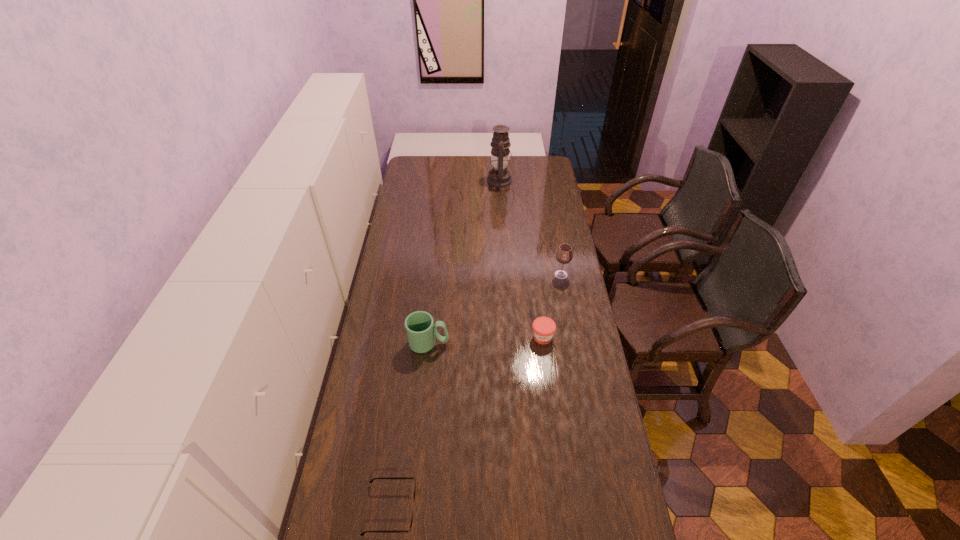
Where is `the tallest object`? The height and width of the screenshot is (540, 960). the tallest object is located at coordinates (499, 176).

The width and height of the screenshot is (960, 540). Find the location of `oil lamp`. oil lamp is located at coordinates (499, 176).

Identify the location of the rightmost object. (564, 255).

This screenshot has height=540, width=960. Identify the location of the fourth shortest object. (564, 255).

Find the location of a particular element. The image size is (960, 540). mug is located at coordinates (421, 332).

You are a GUI agent. You are given a task and a screenshot of the screen. Output one action in this format:
    pyautogui.click(x=<x>, y=<y>)
    Task: Click on the fourth object from left to right
    
    Given the screenshot: What is the action you would take?
    pyautogui.click(x=543, y=327)

Find the location of a particular element. This screenshot has height=540, width=960. jam is located at coordinates (543, 327).

Locate an element on the screen. spectacles is located at coordinates (409, 530).

Identify the location of the nearest object. This screenshot has height=540, width=960. (409, 530).

Where is `vacant space located on the left of the oil lamp`? This screenshot has height=540, width=960. vacant space located on the left of the oil lamp is located at coordinates (470, 181).